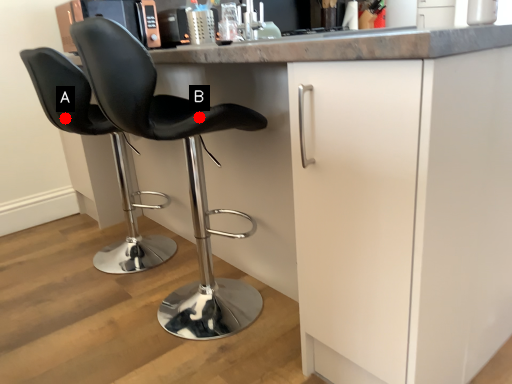
Question: Two points are circled on the image, labeled by A and B beside each circle. Which of the following is the closest to the observer?

Choices:
 (A) A is closer
 (B) B is closer

Answer: (B)